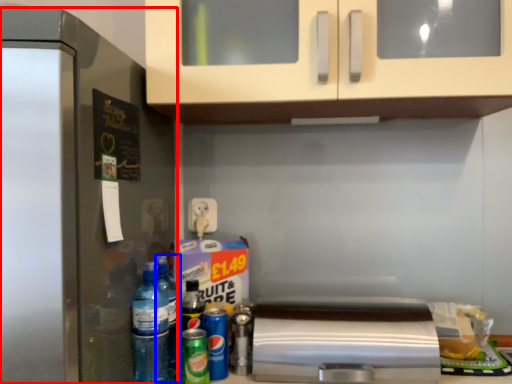
Question: Which point is further to the camera, refrigerator (highlighted by a red box) or bottle (highlighted by a blue box)?

Choices:
 (A) refrigerator
 (B) bottle

Answer: (B)